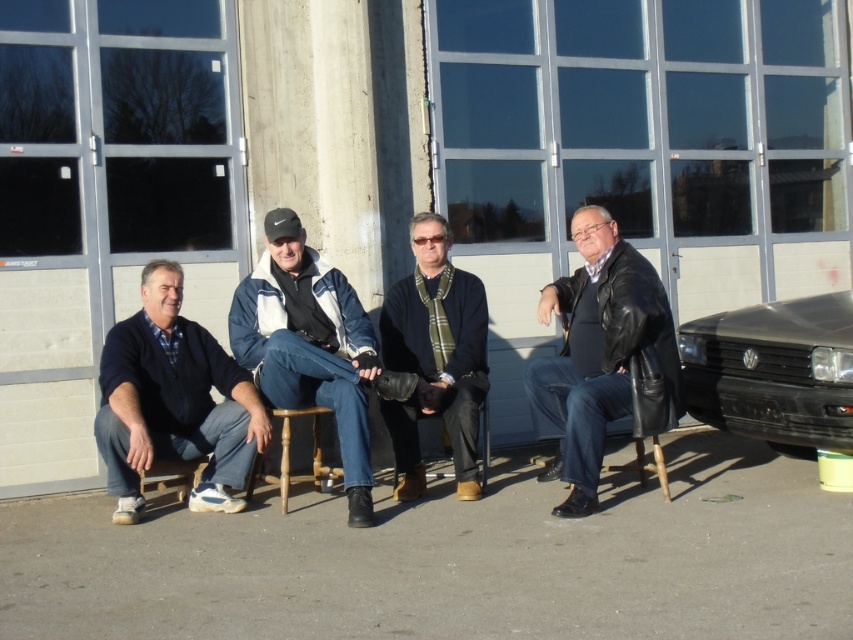
Question: Which point is closer to the camera?

Choices:
 (A) dark blue sweater at left
 (B) black matte car at right

Answer: (B)

Question: Is black leather jacket at center behind white fleece jacket at center?

Choices:
 (A) no
 (B) yes

Answer: (B)

Question: Which object appears farthest from the camera in this image?

Choices:
 (A) black leather jacket at center
 (B) black matte car at right
 (C) white fleece jacket at center
 (D) dark blue sweater at center

Answer: (D)

Question: Which of these objects is positioned farthest from the black leather jacket at center?

Choices:
 (A) dark blue sweater at center
 (B) dark blue sweater at left
 (C) white fleece jacket at center

Answer: (B)

Question: Observing the image, what is the correct spatial positioning of dark blue sweater at left in reference to dark blue sweater at center?

Choices:
 (A) right
 (B) left

Answer: (B)

Question: Does white fleece jacket at center appear on the left side of dark blue sweater at center?

Choices:
 (A) no
 (B) yes

Answer: (B)